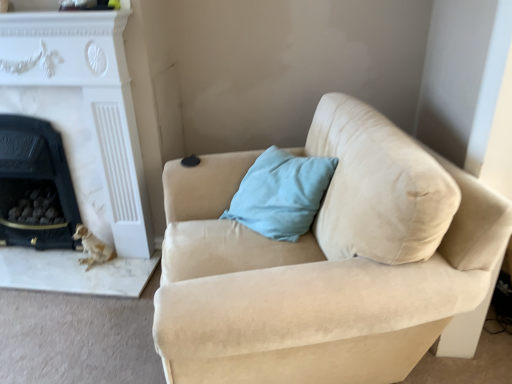
Question: Is white marble fireplace at left, marked as the second fireplace in a left-to-right arrangement, shorter than beige suede couch at center?

Choices:
 (A) no
 (B) yes

Answer: (A)

Question: Is the position of white marble fireplace at left, marked as the second fireplace in a left-to-right arrangement, less distant than that of beige suede couch at center?

Choices:
 (A) no
 (B) yes

Answer: (A)

Question: From a real-world perspective, is white marble fireplace at left, which is counted as the first fireplace, starting from the right, physically above beige suede couch at center?

Choices:
 (A) yes
 (B) no

Answer: (A)

Question: From the image's perspective, is white marble fireplace at left, which is counted as the first fireplace, starting from the right, located beneath beige suede couch at center?

Choices:
 (A) no
 (B) yes

Answer: (A)

Question: Considering the relative positions of white marble fireplace at left, which is counted as the first fireplace, starting from the right, and beige suede couch at center in the image provided, is white marble fireplace at left, which is counted as the first fireplace, starting from the right, to the right of beige suede couch at center from the viewer's perspective?

Choices:
 (A) yes
 (B) no

Answer: (B)

Question: Is black marble fireplace at left, which appears as the 1th fireplace when viewed from the left, not within white marble fireplace at left, marked as the second fireplace in a left-to-right arrangement?

Choices:
 (A) yes
 (B) no

Answer: (B)

Question: Are black marble fireplace at left, the 2th fireplace viewed from the right, and white marble fireplace at left, which is counted as the first fireplace, starting from the right, located far from each other?

Choices:
 (A) no
 (B) yes

Answer: (A)

Question: Can you confirm if black marble fireplace at left, which appears as the 1th fireplace when viewed from the left, is positioned to the right of white marble fireplace at left, marked as the second fireplace in a left-to-right arrangement?

Choices:
 (A) no
 (B) yes

Answer: (A)

Question: Is black marble fireplace at left, which appears as the 1th fireplace when viewed from the left, touching white marble fireplace at left, marked as the second fireplace in a left-to-right arrangement?

Choices:
 (A) no
 (B) yes

Answer: (A)

Question: Is the depth of black marble fireplace at left, the 2th fireplace viewed from the right, less than that of white marble fireplace at left, marked as the second fireplace in a left-to-right arrangement?

Choices:
 (A) no
 (B) yes

Answer: (A)

Question: Does black marble fireplace at left, which appears as the 1th fireplace when viewed from the left, have a greater width compared to white marble fireplace at left, which is counted as the first fireplace, starting from the right?

Choices:
 (A) no
 (B) yes

Answer: (B)

Question: Is beige suede couch at center turned away from black marble fireplace at left, which appears as the 1th fireplace when viewed from the left?

Choices:
 (A) no
 (B) yes

Answer: (A)